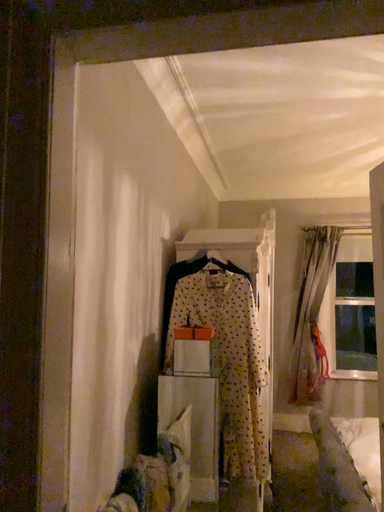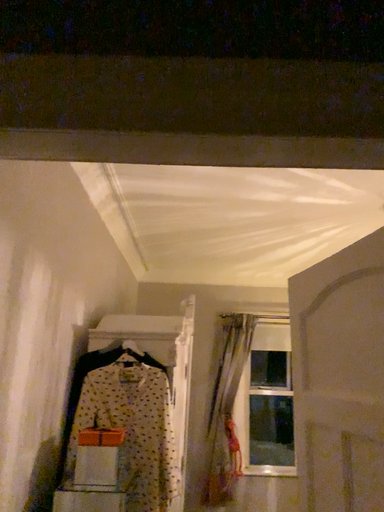
Question: Which way did the camera rotate in the video?

Choices:
 (A) rotated upward
 (B) rotated downward

Answer: (A)